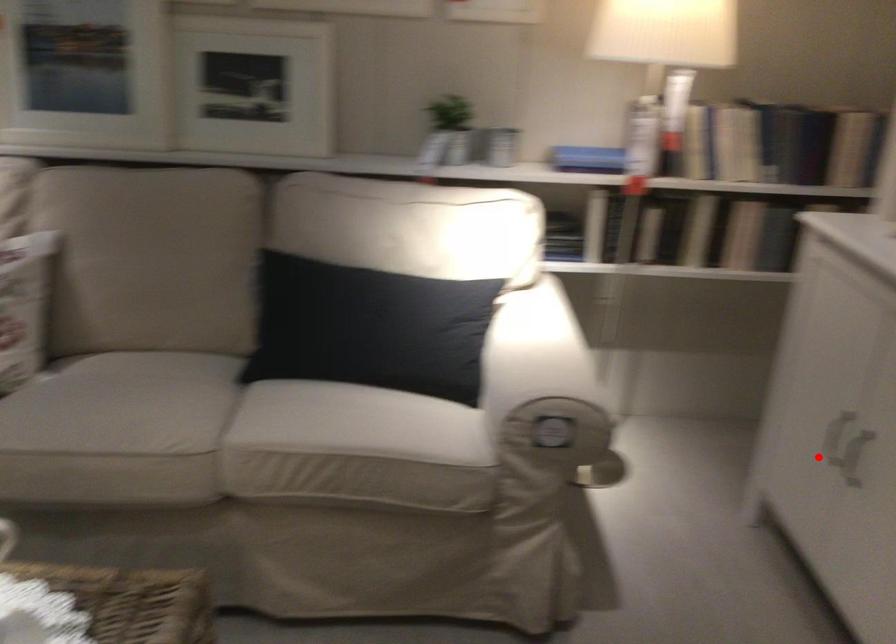
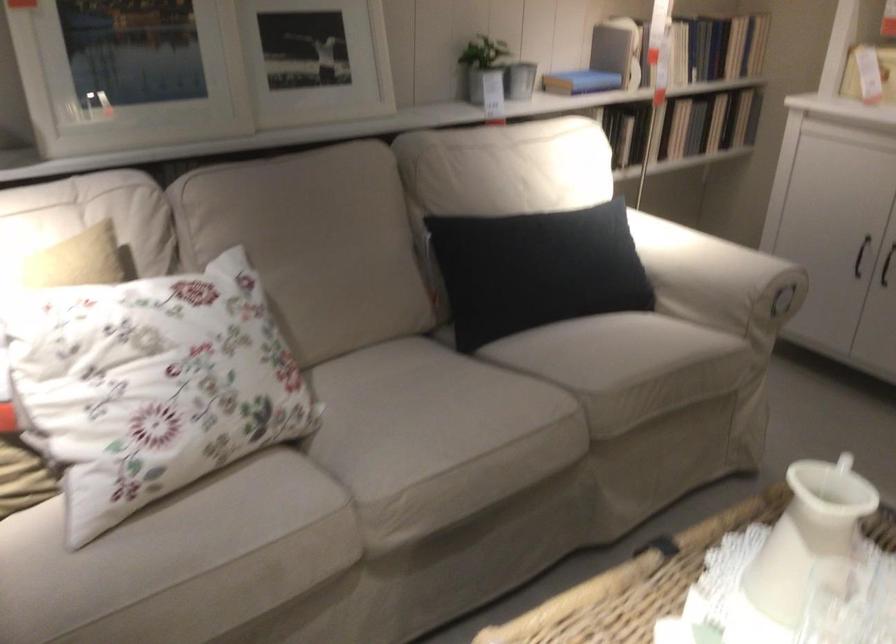
In the second image, find the point that corresponds to the highlighted location in the first image.

(886, 265)